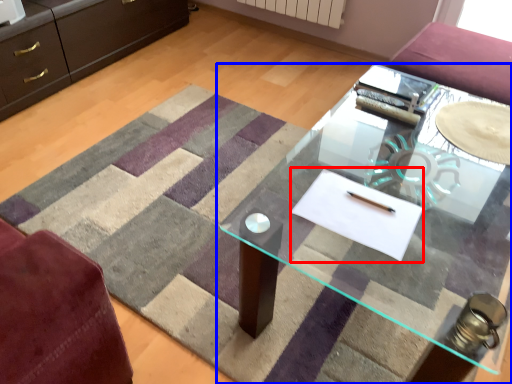
Question: Which object is closer to the camera taking this photo, flat (highlighted by a red box) or table (highlighted by a blue box)?

Choices:
 (A) flat
 (B) table

Answer: (A)